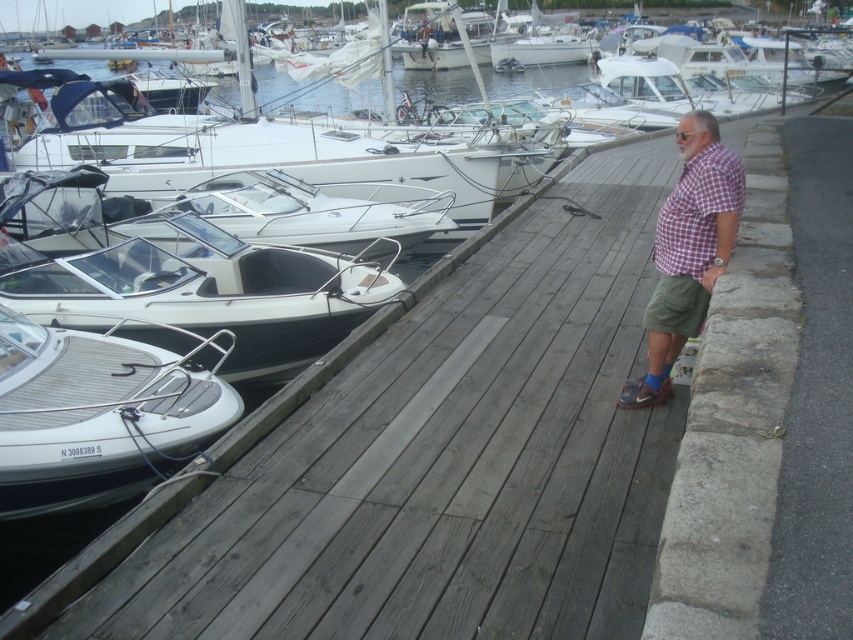
You are a photographer trying to capture the entire gray wood dock at center and checkered fabric shirt at center in one frame. Given that the camera can only focus on objects within a 3 meter width, will both objects fit within the frame?

The gray wood dock at center has a lesser width compared to checkered fabric shirt at center, so the total width of both objects combined may exceed the camera frame limit. Therefore, it might not fit within the 3 meter width.

You are a dock worker who needs to move a 1.5 meter long ladder from the white glossy boat at left to the white textured boat at left. Can you safely carry the ladder horizontally between them without it touching either boat?

The distance between the white glossy boat at left and the white textured boat at left is 1.29 meters. Since the ladder is 1.5 meters long, it would extend beyond the space between them, making it unsafe to carry horizontally without touching the boats.

You are standing on the gray wood dock at center and want to walk towards the checkered fabric shirt at center. Which direction should you move?

The gray wood dock at center is to the left of the checkered fabric shirt at center, so you should move to the right to reach the checkered fabric shirt at center.